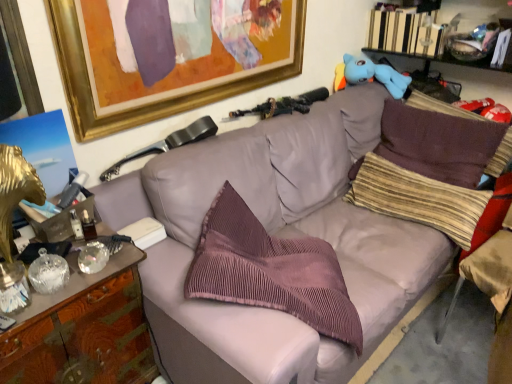
Question: Is pink corduroy pillow at center, acting as the 1th pillow starting from the left, turned away from goldmaterial/texturepicture frame at upper left?

Choices:
 (A) yes
 (B) no

Answer: (B)

Question: Is pink corduroy pillow at center, placed as the third pillow when sorted from right to left, not inside goldmaterial/texturepicture frame at upper left?

Choices:
 (A) yes
 (B) no

Answer: (A)

Question: From the image's perspective, would you say pink corduroy pillow at center, acting as the 1th pillow starting from the left, is positioned over goldmaterial/texturepicture frame at upper left?

Choices:
 (A) yes
 (B) no

Answer: (B)

Question: Does pink corduroy pillow at center, placed as the third pillow when sorted from right to left, have a greater width compared to goldmaterial/texturepicture frame at upper left?

Choices:
 (A) no
 (B) yes

Answer: (B)

Question: From the image's perspective, would you say pink corduroy pillow at center, acting as the 1th pillow starting from the left, is shown under goldmaterial/texturepicture frame at upper left?

Choices:
 (A) yes
 (B) no

Answer: (A)

Question: Is pink corduroy pillow at center, acting as the 1th pillow starting from the left, in front of goldmaterial/texturepicture frame at upper left?

Choices:
 (A) no
 (B) yes

Answer: (B)

Question: Is the surface of brown corduroy pillow at right, which appears as the 1th pillow when viewed from the right, in direct contact with matte gray swivel chair at upper center?

Choices:
 (A) yes
 (B) no

Answer: (B)

Question: Are brown corduroy pillow at right, which appears as the 1th pillow when viewed from the right, and matte gray swivel chair at upper center far apart?

Choices:
 (A) no
 (B) yes

Answer: (B)

Question: Can you confirm if brown corduroy pillow at right, the 3th pillow from the left, is thinner than matte gray swivel chair at upper center?

Choices:
 (A) yes
 (B) no

Answer: (B)

Question: Does brown corduroy pillow at right, which appears as the 1th pillow when viewed from the right, contain matte gray swivel chair at upper center?

Choices:
 (A) yes
 (B) no

Answer: (B)

Question: Could you tell me if brown corduroy pillow at right, the 3th pillow from the left, is turned towards matte gray swivel chair at upper center?

Choices:
 (A) yes
 (B) no

Answer: (A)

Question: Is brown corduroy pillow at right, the 3th pillow from the left, positioned beyond the bounds of matte gray swivel chair at upper center?

Choices:
 (A) yes
 (B) no

Answer: (A)

Question: From a real-world perspective, does white paper at center, arranged as the first book when viewed from the left, stand above blue plush toy at upper right?

Choices:
 (A) no
 (B) yes

Answer: (A)